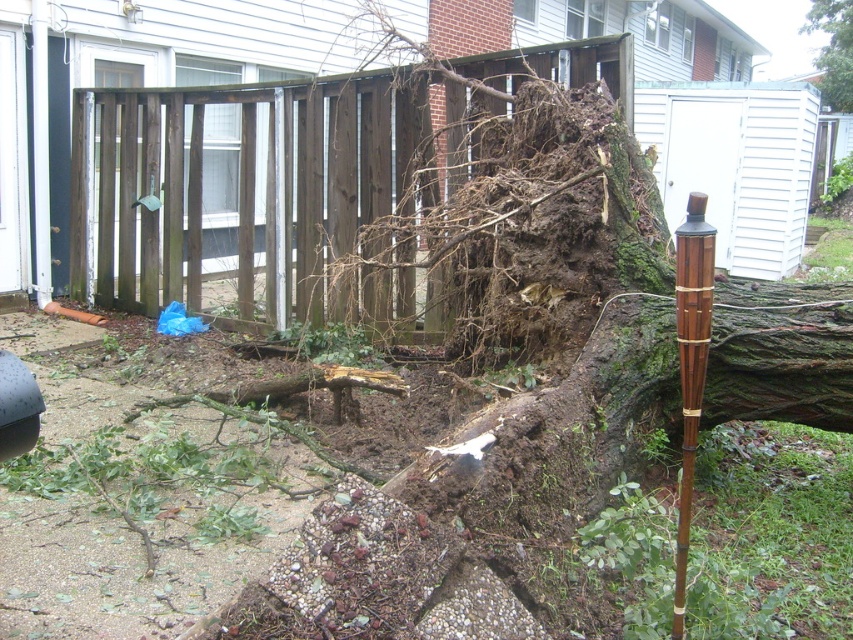
Does brown wooden fence at center come in front of brown bamboo pole at center?

No, brown wooden fence at center is further to the viewer.

Who is more forward, (288, 141) or (682, 547)?

Point (682, 547) is more forward.

Who is more distant from viewer, (268, 124) or (688, 468)?

Positioned behind is point (268, 124).

Locate an element on the screen. The image size is (853, 640). brown wooden fence at center is located at coordinates (267, 195).

Who is positioned more to the right, brown bamboo pole at center or green rough bark tree at upper right?

From the viewer's perspective, green rough bark tree at upper right appears more on the right side.

Does point (701, 378) lie in front of point (848, 96)?

That is True.

What do you see at coordinates (689, 365) in the screenshot? The image size is (853, 640). I see `brown bamboo pole at center` at bounding box center [689, 365].

The width and height of the screenshot is (853, 640). What are the coordinates of `brown bamboo pole at center` in the screenshot? It's located at (689, 365).

Between point (231, 96) and point (842, 29), which one is positioned behind?

The point (842, 29) is more distant.

This screenshot has height=640, width=853. What do you see at coordinates (267, 195) in the screenshot?
I see `brown wooden fence at center` at bounding box center [267, 195].

Where is `brown wooden fence at center`? The image size is (853, 640). brown wooden fence at center is located at coordinates (267, 195).